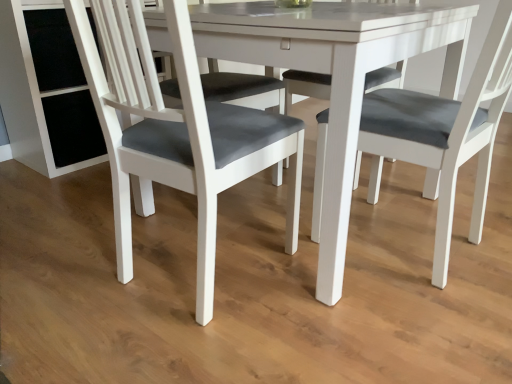
Question: From a real-world perspective, is matte gray fabric chair at left over white glossy table at center?

Choices:
 (A) no
 (B) yes

Answer: (B)

Question: Is matte gray fabric chair at left taller than white glossy table at center?

Choices:
 (A) yes
 (B) no

Answer: (A)

Question: Is white glossy table at center located within matte gray fabric chair at left?

Choices:
 (A) yes
 (B) no

Answer: (B)

Question: Considering the relative sizes of matte gray fabric chair at left and white glossy table at center in the image provided, is matte gray fabric chair at left shorter than white glossy table at center?

Choices:
 (A) no
 (B) yes

Answer: (A)

Question: Is matte gray fabric chair at left further to the viewer compared to white glossy table at center?

Choices:
 (A) yes
 (B) no

Answer: (B)

Question: Does matte gray fabric chair at left have a larger size compared to white glossy table at center?

Choices:
 (A) yes
 (B) no

Answer: (B)

Question: From a real-world perspective, is white glossy table at center located higher than matte gray fabric chair at left?

Choices:
 (A) no
 (B) yes

Answer: (A)

Question: Is white glossy table at center placed right next to matte gray fabric chair at left?

Choices:
 (A) yes
 (B) no

Answer: (B)

Question: From the image's perspective, is white glossy table at center located beneath matte gray fabric chair at left?

Choices:
 (A) no
 (B) yes

Answer: (A)

Question: Does white glossy table at center lie behind matte gray fabric chair at left?

Choices:
 (A) yes
 (B) no

Answer: (A)

Question: Does white glossy table at center have a lesser height compared to matte gray fabric chair at left?

Choices:
 (A) no
 (B) yes

Answer: (B)

Question: Considering the relative sizes of white glossy table at center and matte gray fabric chair at left in the image provided, is white glossy table at center wider than matte gray fabric chair at left?

Choices:
 (A) no
 (B) yes

Answer: (B)

Question: In the image, is white glossy table at center on the left side or the right side of matte gray fabric chair at left?

Choices:
 (A) right
 (B) left

Answer: (A)